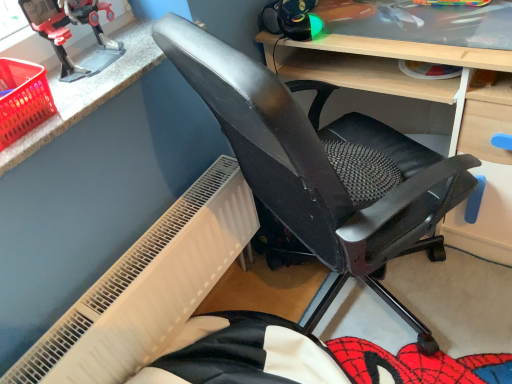
Question: From the image's perspective, is black mesh chair at center above metallic plastic toy robot at upper left?

Choices:
 (A) no
 (B) yes

Answer: (A)

Question: From the image's perspective, is black mesh chair at center beneath metallic plastic toy robot at upper left?

Choices:
 (A) no
 (B) yes

Answer: (B)

Question: Is the depth of black mesh chair at center greater than that of metallic plastic toy robot at upper left?

Choices:
 (A) yes
 (B) no

Answer: (B)

Question: Does black mesh chair at center have a larger size compared to metallic plastic toy robot at upper left?

Choices:
 (A) yes
 (B) no

Answer: (A)

Question: Does black mesh chair at center have a greater height compared to metallic plastic toy robot at upper left?

Choices:
 (A) yes
 (B) no

Answer: (A)

Question: In terms of size, does matte black chair at center appear bigger or smaller than black mesh chair at center?

Choices:
 (A) big
 (B) small

Answer: (B)

Question: In terms of height, does matte black chair at center look taller or shorter compared to black mesh chair at center?

Choices:
 (A) short
 (B) tall

Answer: (A)

Question: From the image's perspective, is matte black chair at center above or below black mesh chair at center?

Choices:
 (A) above
 (B) below

Answer: (A)

Question: Is point (498, 92) closer or farther from the camera than point (224, 48)?

Choices:
 (A) farther
 (B) closer

Answer: (A)

Question: In terms of width, does white textured radiator at lower left look wider or thinner when compared to black mesh chair at center?

Choices:
 (A) wide
 (B) thin

Answer: (B)

Question: Does point (51, 344) appear closer or farther from the camera than point (350, 251)?

Choices:
 (A) farther
 (B) closer

Answer: (A)

Question: From the image's perspective, relative to black mesh chair at center, is white textured radiator at lower left above or below?

Choices:
 (A) above
 (B) below

Answer: (B)

Question: Choose the correct answer: Is white textured radiator at lower left inside black mesh chair at center or outside it?

Choices:
 (A) inside
 (B) outside

Answer: (B)

Question: Is white textured radiator at lower left situated inside metallic plastic toy robot at upper left or outside?

Choices:
 (A) inside
 (B) outside

Answer: (B)

Question: Is white textured radiator at lower left taller or shorter than metallic plastic toy robot at upper left?

Choices:
 (A) short
 (B) tall

Answer: (B)